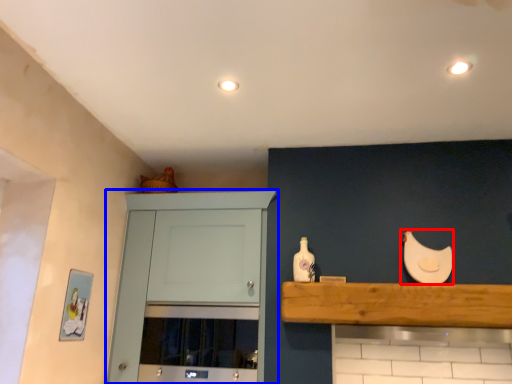
Question: Which object is closer to the camera taking this photo, chicken (highlighted by a red box) or cabinetry (highlighted by a blue box)?

Choices:
 (A) chicken
 (B) cabinetry

Answer: (B)